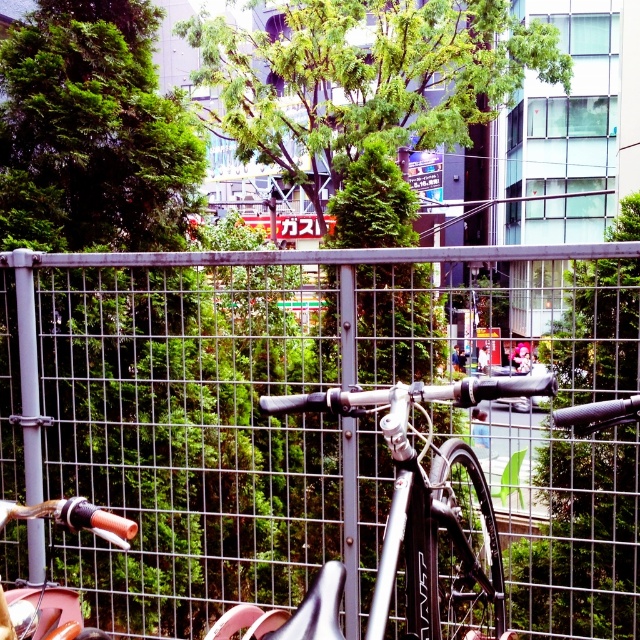
Question: Is metal mesh fence at center wider than shiny orange handlebar at left?

Choices:
 (A) no
 (B) yes

Answer: (B)

Question: Can you confirm if metal mesh fence at center is positioned below shiny orange handlebar at left?

Choices:
 (A) yes
 (B) no

Answer: (B)

Question: Which object appears closest to the camera in this image?

Choices:
 (A) shiny orange handlebar at left
 (B) metal mesh fence at center

Answer: (A)

Question: Among these points, which one is farthest from the camera?

Choices:
 (A) (362, 419)
 (B) (45, 502)

Answer: (A)

Question: Considering the relative positions of metal mesh fence at center and shiny orange handlebar at left in the image provided, where is metal mesh fence at center located with respect to shiny orange handlebar at left?

Choices:
 (A) below
 (B) above

Answer: (B)